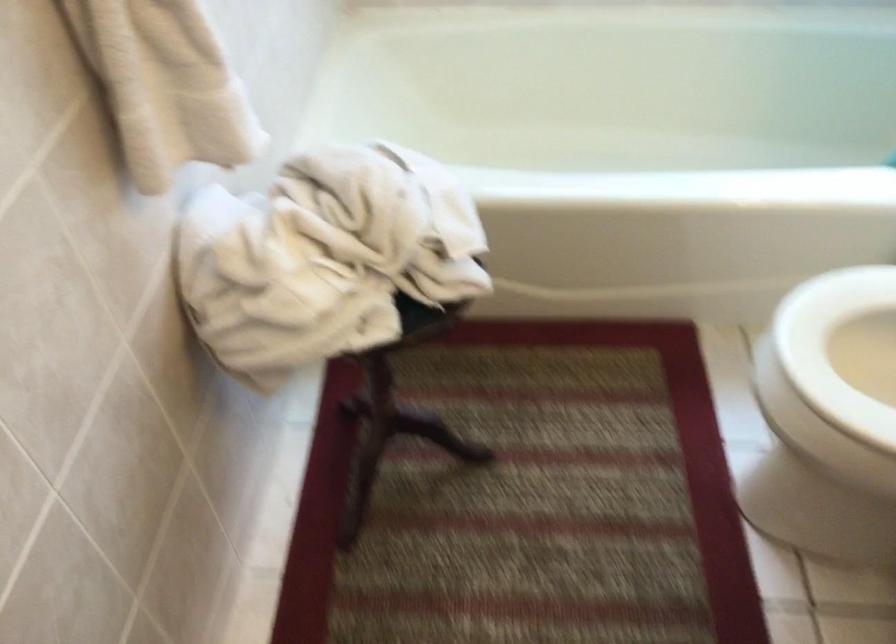
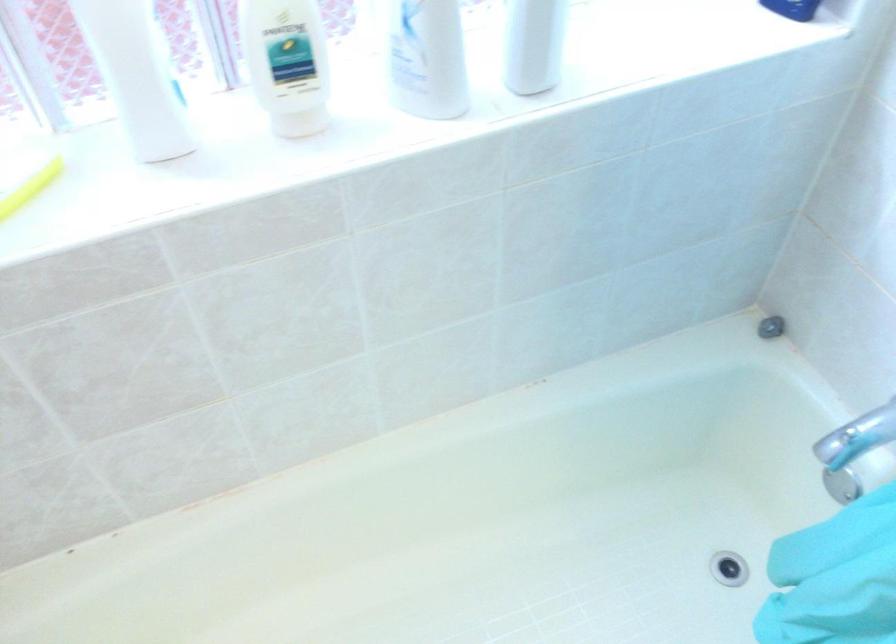
Question: What movement of the cameraman would produce the second image?

Choices:
 (A) Left
 (B) Right
 (C) Forward
 (D) Backward

Answer: (C)